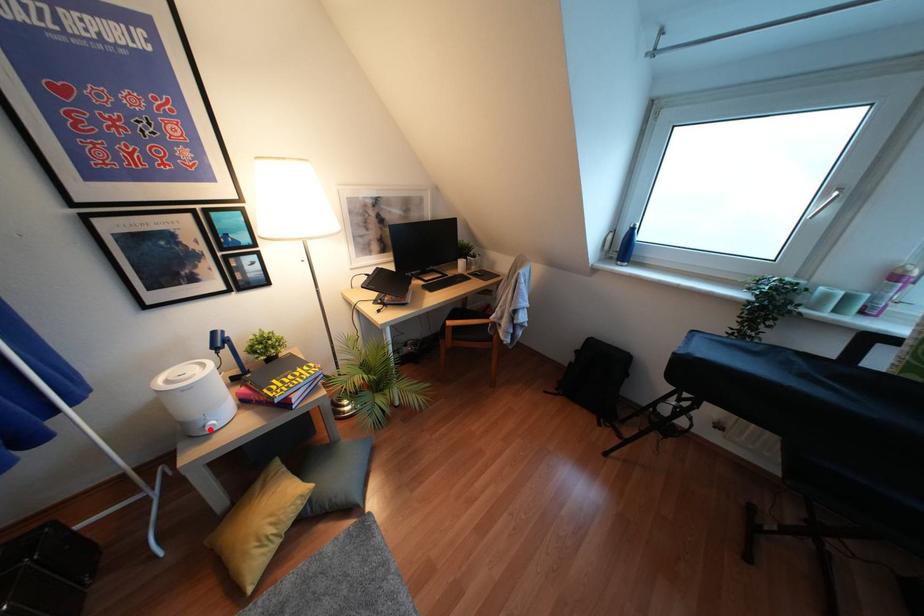
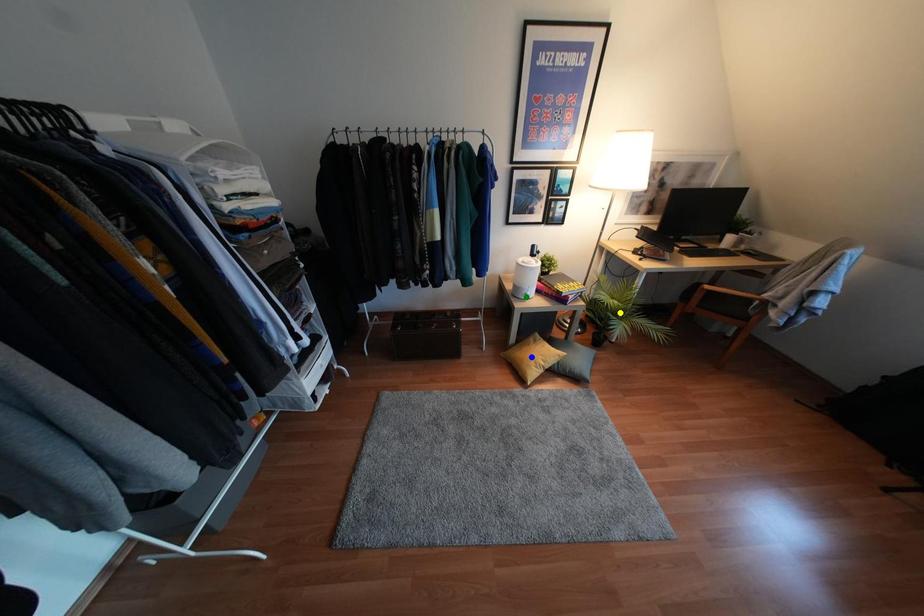
Question: I am providing you with two images of the same scene from different viewpoints. A red point is marked on the first image. You are given multiple points on the second image. In image 2, which mark is for the same physical point as the one in image 1?

Choices:
 (A) blue point
 (B) yellow point
 (C) green point

Answer: (C)